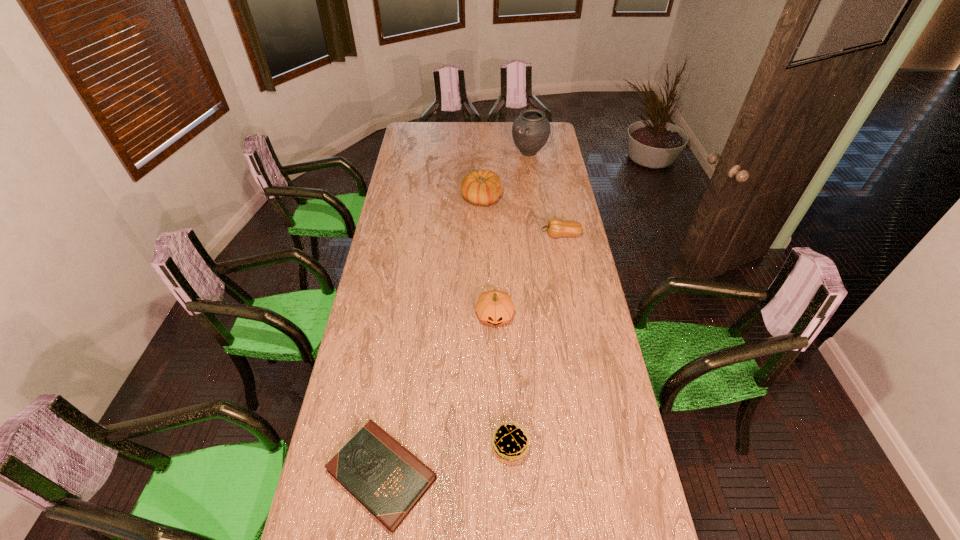
Find the location of `free space located on the front of the farthest gourd`. free space located on the front of the farthest gourd is located at coordinates (482, 232).

The image size is (960, 540). Find the location of `vacant space located on the side of the nearest gourd with the carved face`. vacant space located on the side of the nearest gourd with the carved face is located at coordinates (497, 394).

This screenshot has width=960, height=540. I want to click on vacant space positioned on the stem side of the second nearest gourd, so click(476, 235).

Find the location of a particular element. The image size is (960, 540). vacant position located on the stem side of the second nearest gourd is located at coordinates (511, 235).

The width and height of the screenshot is (960, 540). Identify the location of free space located on the stem side of the second nearest gourd. (468, 235).

At what (x,y) coordinates should I click in order to perform the action: click on vacant area situated 0.240m on the right of the patty. Please return your answer as a coordinate pair (x, y). This screenshot has height=540, width=960. Looking at the image, I should click on (608, 447).

I want to click on vacant area situated on the right of the Bible, so click(x=527, y=474).

Locate an element on the screen. This screenshot has height=540, width=960. object that is at the left edge is located at coordinates (388, 480).

At what (x,y) coordinates should I click in order to perform the action: click on urn present at the right edge. Please return your answer as a coordinate pair (x, y). The width and height of the screenshot is (960, 540). Looking at the image, I should click on (531, 130).

You are a GUI agent. You are given a task and a screenshot of the screen. Output one action in this format:
    pyautogui.click(x=<x>, y=<y>)
    Task: Click on the gourd at the right edge
    This screenshot has width=960, height=540.
    Given the screenshot: What is the action you would take?
    pyautogui.click(x=556, y=227)